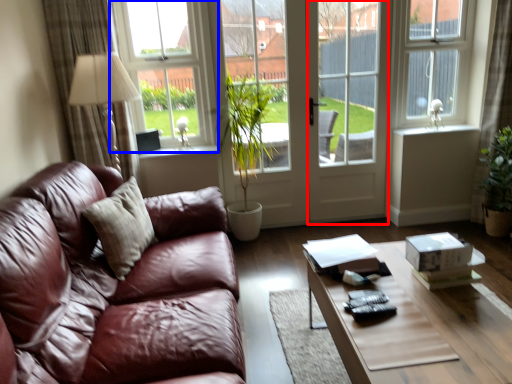
Question: Which object appears closest to the camera in this image, screen door (highlighted by a red box) or window (highlighted by a blue box)?

Choices:
 (A) screen door
 (B) window

Answer: (B)